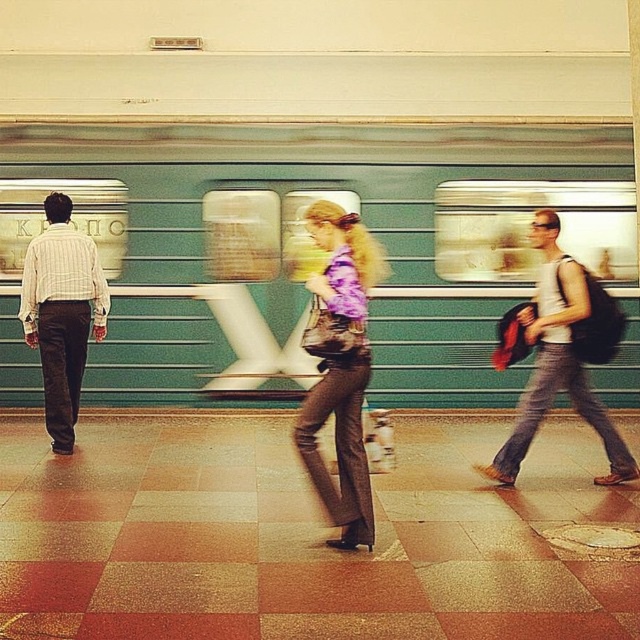
Does teal glossy train at center appear on the left side of striped cotton shirt at left?

No, teal glossy train at center is not to the left of striped cotton shirt at left.

Is point (536, 180) positioned in front of point (52, 275)?

No.

Identify the location of teal glossy train at center. The width and height of the screenshot is (640, 640). (312, 250).

Does teal glossy train at center have a lesser width compared to matte purple shirt at center?

No, teal glossy train at center is not thinner than matte purple shirt at center.

Who is more distant from viewer, [464,264] or [336,260]?

The point [464,264] is behind.

Between point (192, 161) and point (307, 422), which one is positioned behind?

The point (192, 161) is behind.

I want to click on teal glossy train at center, so pos(312,250).

Between point (426, 269) and point (573, 275), which one is positioned behind?

Positioned behind is point (426, 269).

Which is in front, point (125, 253) or point (584, 372)?

Positioned in front is point (584, 372).

Find the location of a particular element. The width and height of the screenshot is (640, 640). teal glossy train at center is located at coordinates (312, 250).